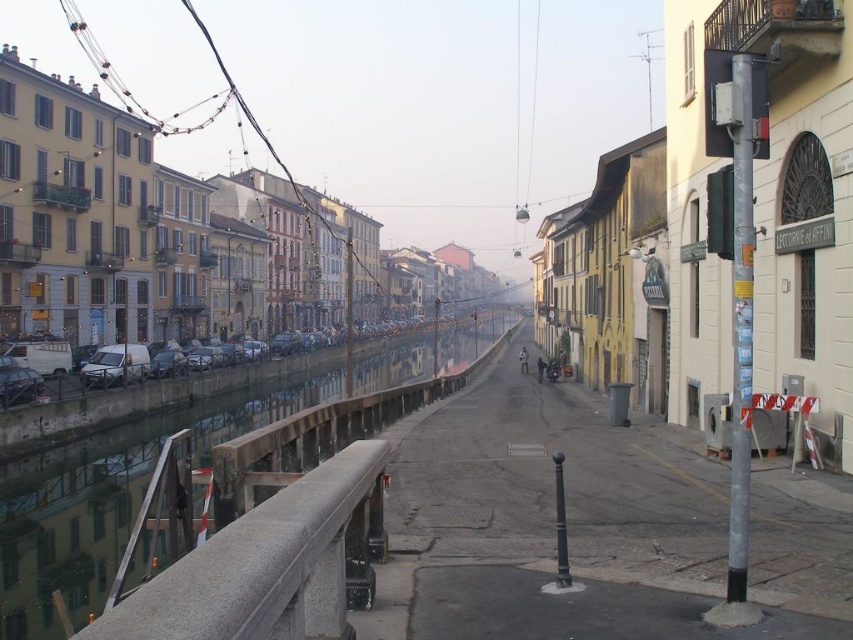
You are a tourist standing on the street next to the gray concrete rail at left and the silver metallic van at left. Which object is closer to the canal?

The gray concrete rail at left is closer to the canal because it is positioned to the right of the silver metallic van at left, which would place it nearer to the waterway.

You are standing on the street next to the gray concrete rail at left. If you walk straight ahead, will you move towards the canal or away from it?

The gray concrete rail at left is located at point (260,566). Since the rail is on the left side of the street, walking straight ahead would take you away from the canal towards the buildings.